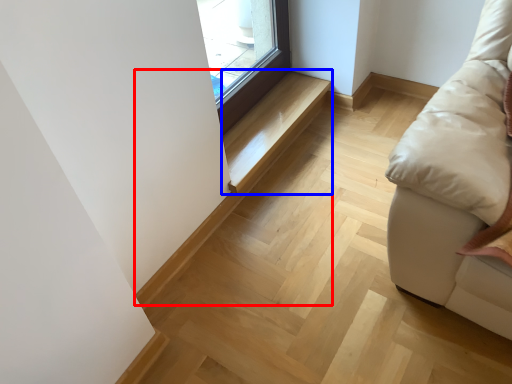
Question: Which of the following is the closest to the observer, stairwell (highlighted by a red box) or stairwell (highlighted by a blue box)?

Choices:
 (A) stairwell
 (B) stairwell

Answer: (A)